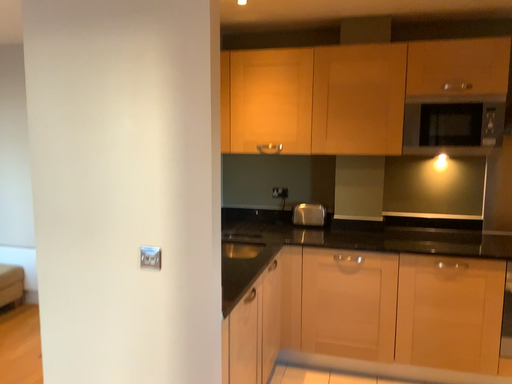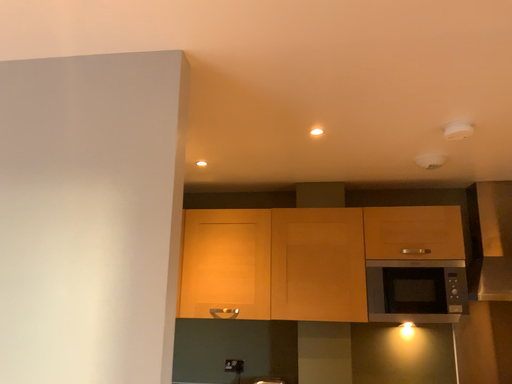
Question: Which way did the camera rotate in the video?

Choices:
 (A) rotated left
 (B) rotated right

Answer: (B)